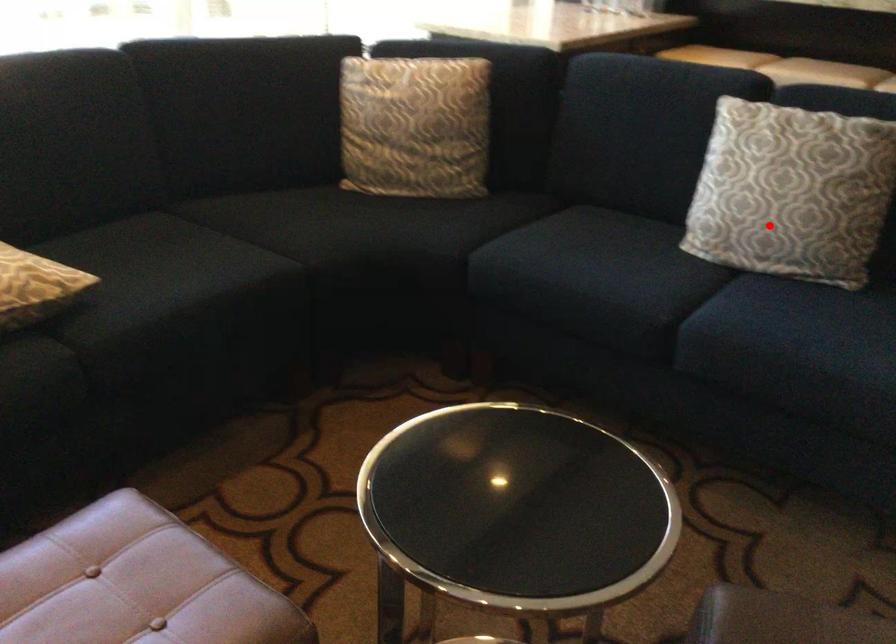
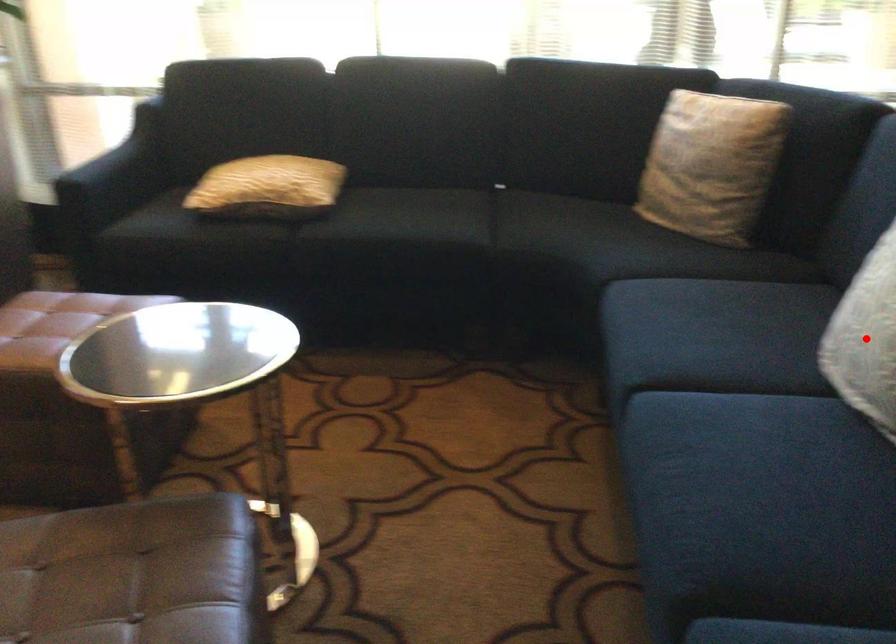
I am providing you with two images of the same scene from different viewpoints. A red point is marked on the first image and another point is marked on the second image. Do the highlighted points in image1 and image2 indicate the same real-world spot?

Yes